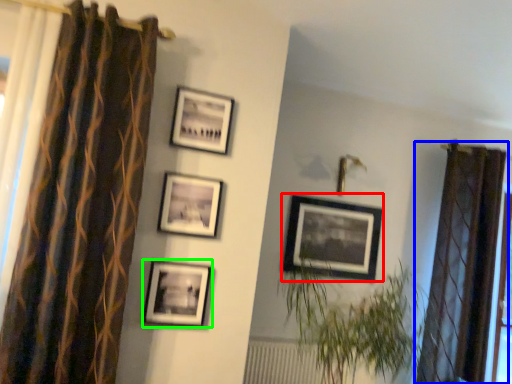
Question: Based on their relative distances, which object is farther from picture frame (highlighted by a red box)? Choose from curtain (highlighted by a blue box) and picture frame (highlighted by a green box).

Choices:
 (A) curtain
 (B) picture frame

Answer: (B)